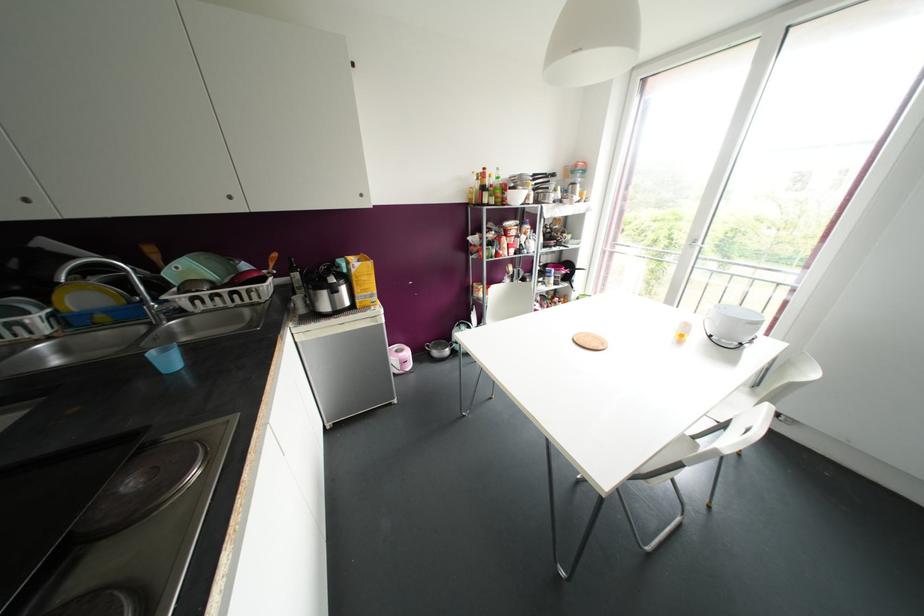
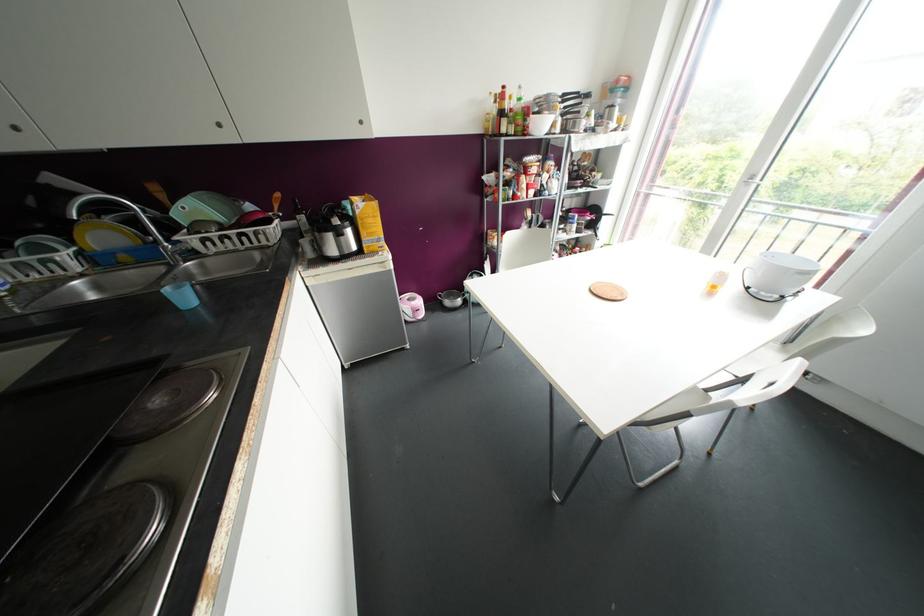
In the second image, find the point that corresponds to point 695,240 in the first image.

(752, 177)